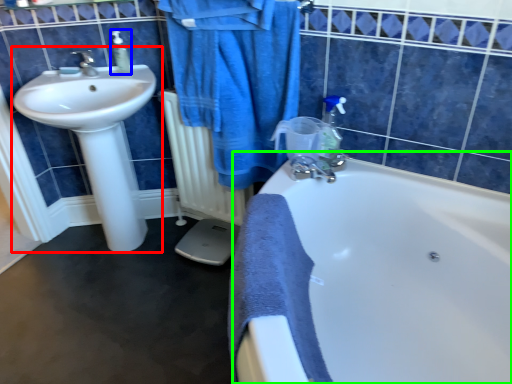
Question: Which object is the farthest from sink (highlighted by a red box)? Choose among these: soap dispenser (highlighted by a blue box) or bathtub (highlighted by a green box).

Choices:
 (A) soap dispenser
 (B) bathtub

Answer: (B)